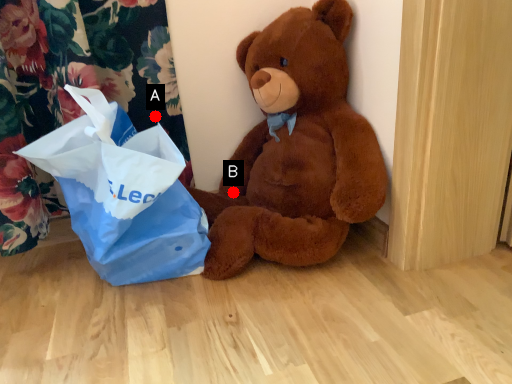
Question: Two points are circled on the image, labeled by A and B beside each circle. Which point appears closest to the camera in this image?

Choices:
 (A) A is closer
 (B) B is closer

Answer: (A)